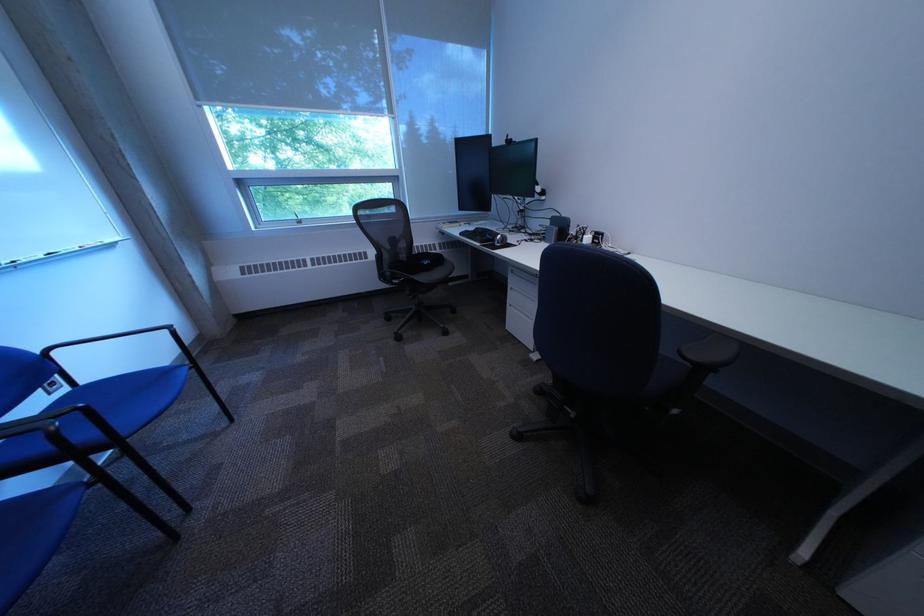
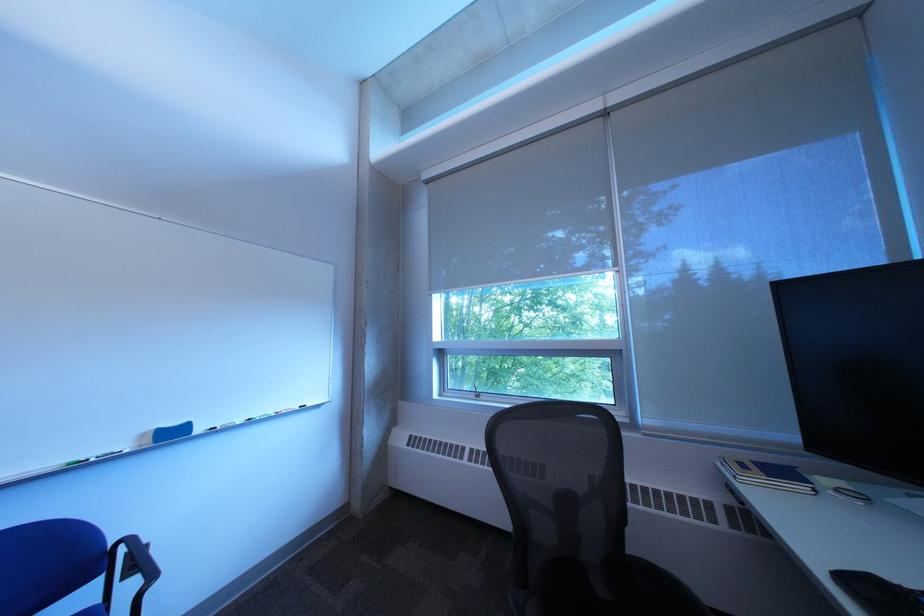
In the second image, find the point that corresponds to the point at 452,229 in the first image.

(733, 468)